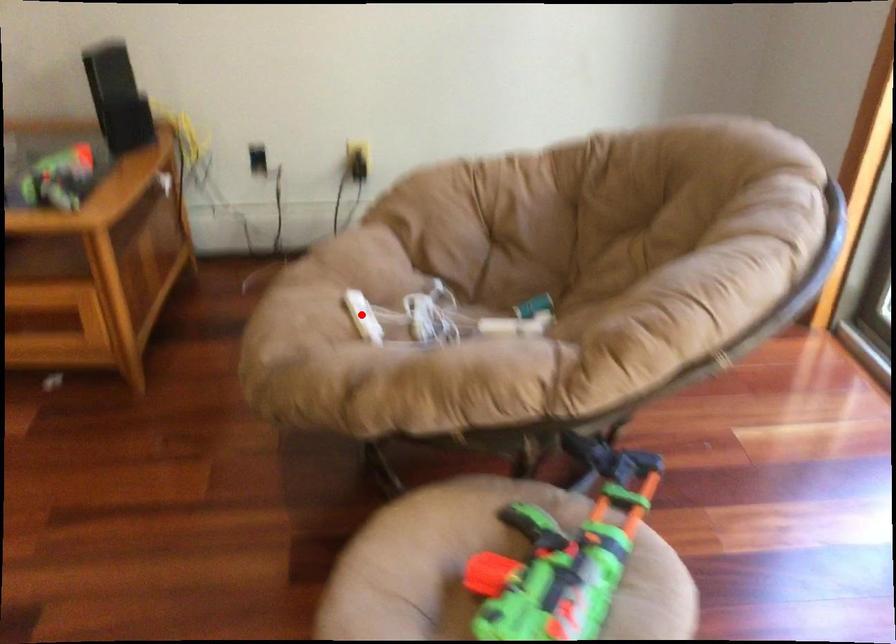
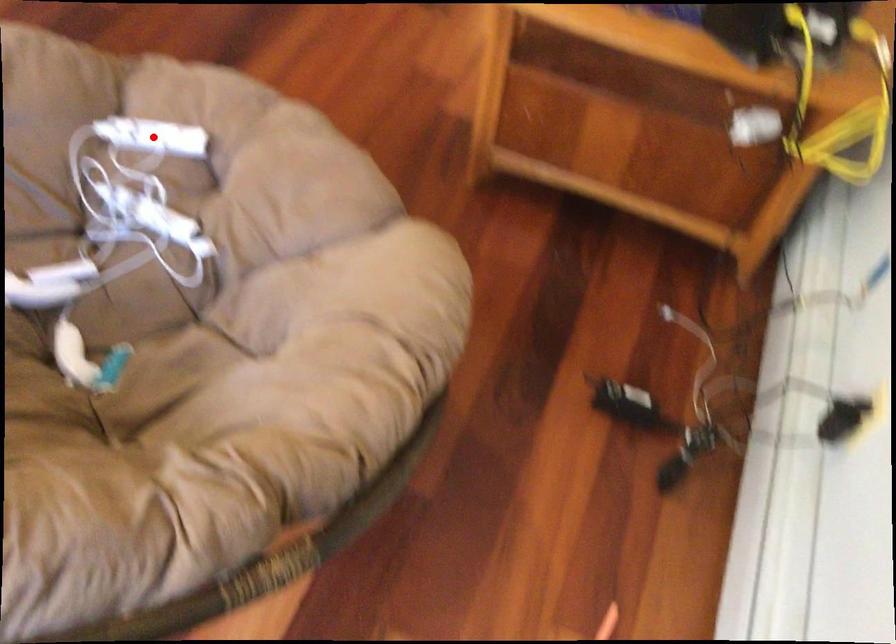
I am providing you with two images of the same scene from different viewpoints. A red point is marked on the first image and another point is marked on the second image. Is the red point in image1 aligned with the point shown in image2?

Yes